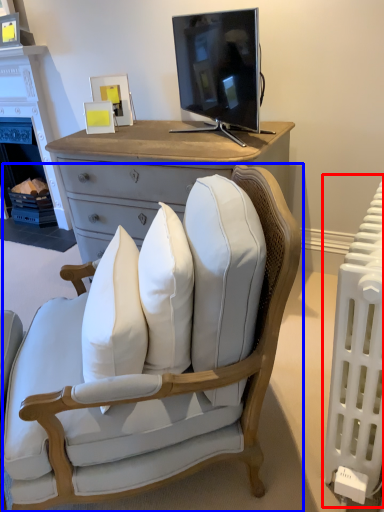
Question: Which object appears farthest to the camera in this image, radiator (highlighted by a red box) or chair (highlighted by a blue box)?

Choices:
 (A) radiator
 (B) chair

Answer: (A)